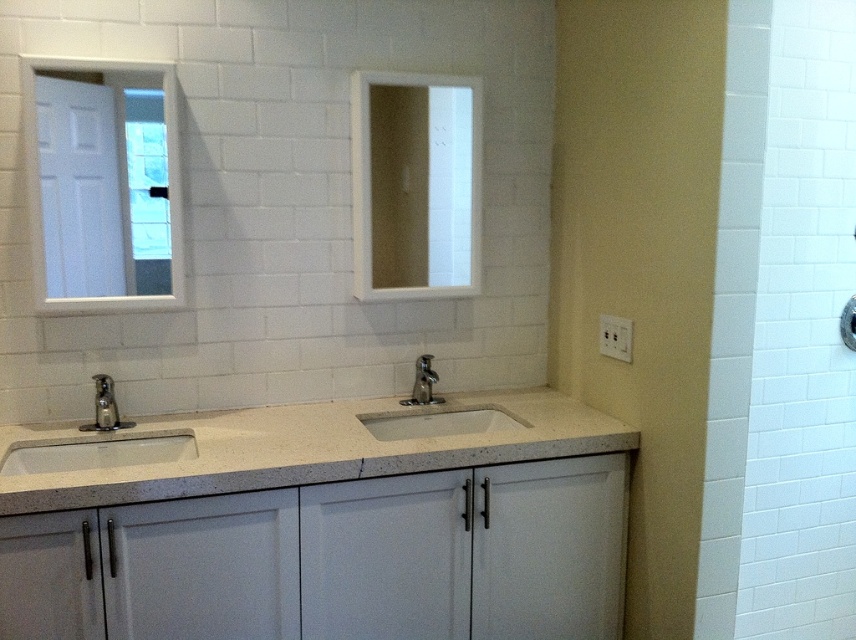
Question: Considering the relative positions of white matte medicine cabinet at upper center and matte silver faucet at left in the image provided, where is white matte medicine cabinet at upper center located with respect to matte silver faucet at left?

Choices:
 (A) left
 (B) right

Answer: (B)

Question: Which of the following is the farthest from the observer?

Choices:
 (A) (177, 451)
 (B) (420, 378)
 (C) (217, 412)

Answer: (B)

Question: Is white speckled granite countertop at center below matte silver faucet at left?

Choices:
 (A) no
 (B) yes

Answer: (B)

Question: Which object is positioned closest to the white matte sink at lower left?

Choices:
 (A) white glossy mirror at upper left
 (B) white matte medicine cabinet at upper center
 (C) sandy beige granite sink at center
 (D) white granite sink at center

Answer: (A)

Question: Does matte white sink at left have a smaller size compared to white matte sink at lower left?

Choices:
 (A) no
 (B) yes

Answer: (A)

Question: Which of the following is the closest to the observer?

Choices:
 (A) [x=97, y=388]
 (B) [x=388, y=412]
 (C) [x=401, y=214]

Answer: (A)